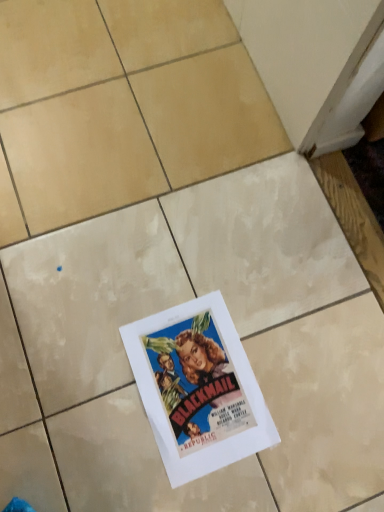
Find the location of a particular element. free space behind matte paper poster at center is located at coordinates (218, 265).